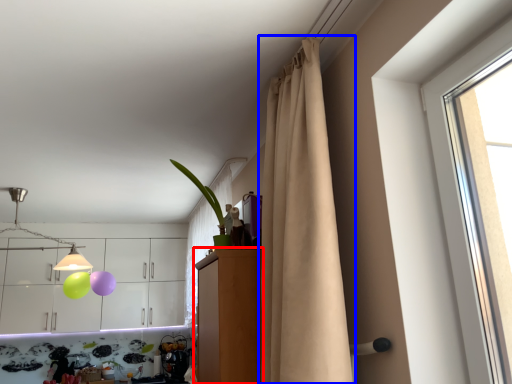
Question: Which of the following is the farthest to the observer, dresser (highlighted by a red box) or curtain (highlighted by a blue box)?

Choices:
 (A) dresser
 (B) curtain

Answer: (A)